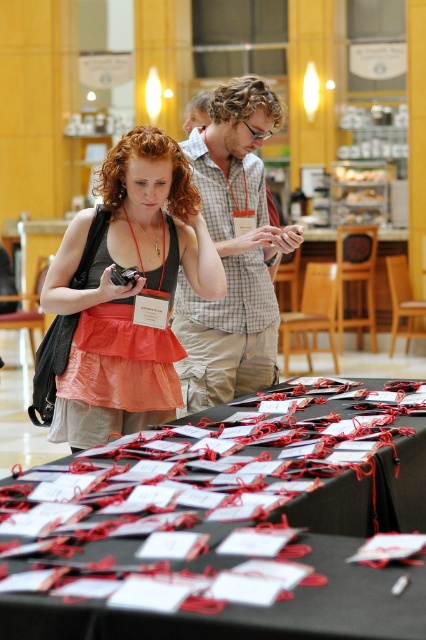
You are a photographer setting up for an event. You have a matte black camera at left and a checkered fabric shirt at center in your view. Which object appears taller in the scene?

The checkered fabric shirt at center is taller than the matte black camera at left.

You are a photographer standing in the scene and need to place a 6 feet long tripod between the black paper bag at lower center and the checkered fabric shirt at center. Is there enough space for the tripod to fit between them?

The black paper bag at lower center and checkered fabric shirt at center are 5.86 feet apart, so there is not enough space to fit a 6 feet long tripod between them.